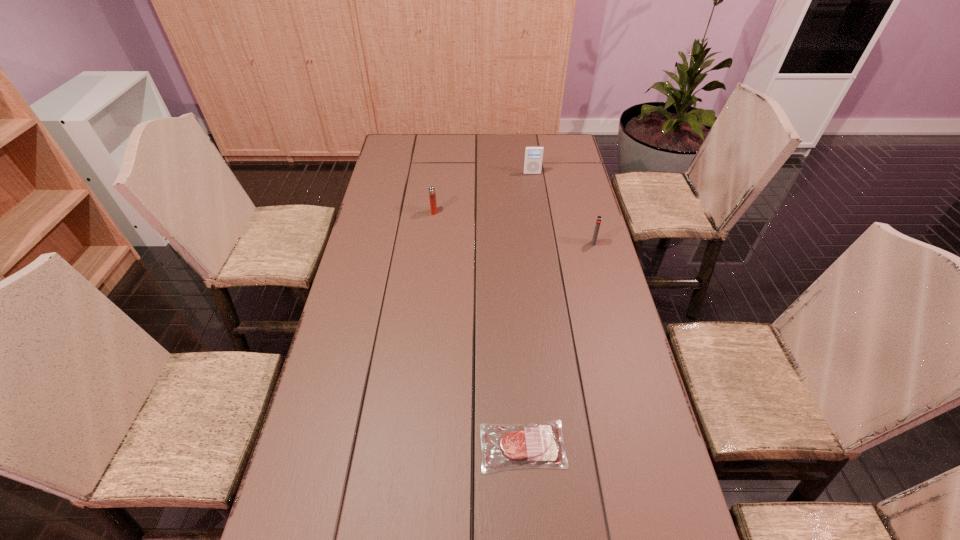
This screenshot has width=960, height=540. I want to click on the farthest object, so click(533, 159).

Identify the location of the left igniter. The image size is (960, 540). (432, 195).

Identify the location of the third nearest object. (432, 195).

Where is `the third farthest object`? the third farthest object is located at coordinates (599, 218).

This screenshot has width=960, height=540. I want to click on the nearer igniter, so click(x=599, y=218).

Image resolution: width=960 pixels, height=540 pixels. Identify the location of the shortest object. (537, 445).

You are a GUI agent. You are given a task and a screenshot of the screen. Output one action in this format:
    pyautogui.click(x=<x>, y=<y>)
    Task: Click on the nearest object
    This screenshot has height=540, width=960.
    Given the screenshot: What is the action you would take?
    pyautogui.click(x=537, y=445)

Where is `vacant space located 0.180m on the front-facing side of the farthest object`? Image resolution: width=960 pixels, height=540 pixels. vacant space located 0.180m on the front-facing side of the farthest object is located at coordinates (536, 200).

Find the location of a particular element. The image size is (960, 540). free space located 0.270m on the right of the farther igniter is located at coordinates (509, 212).

Find the location of a particular element. The width and height of the screenshot is (960, 540). free space located 0.360m on the front of the third farthest object is located at coordinates (616, 329).